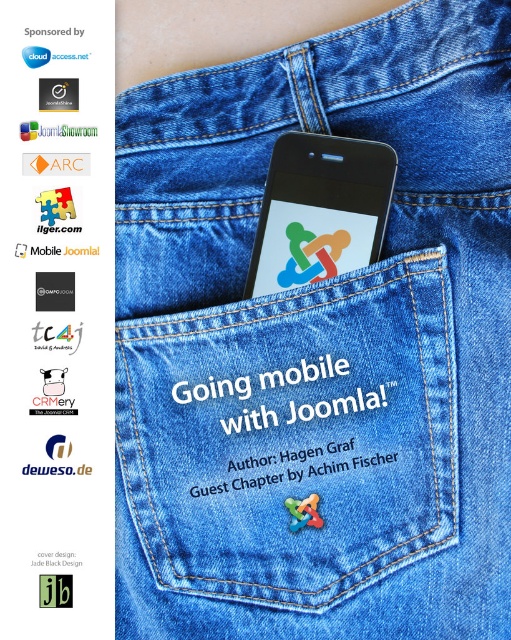
Between point (275, 179) and point (300, 474), which one is positioned in front?

Point (300, 474) is more forward.

How distant is black glossy smartphone at center from green matte joomla logo at center?

10.96 inches

Between point (288, 202) and point (265, 480), which one is positioned behind?

The point (288, 202) is more distant.

Find the location of `black glossy smartphone at center`. black glossy smartphone at center is located at coordinates (320, 209).